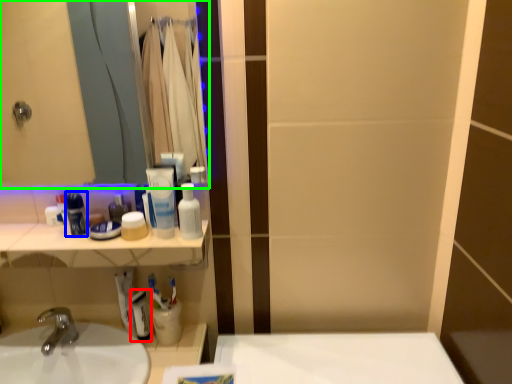
Question: Which object is positioned closest to mouthwash (highlighted by a red box)? Select from mouthwash (highlighted by a blue box) and mirror (highlighted by a green box).

Choices:
 (A) mouthwash
 (B) mirror

Answer: (A)